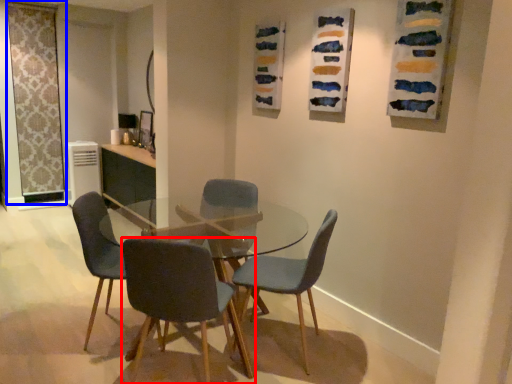
Question: Which object appears closest to the camera in this image, chair (highlighted by a red box) or screen door (highlighted by a blue box)?

Choices:
 (A) chair
 (B) screen door

Answer: (A)